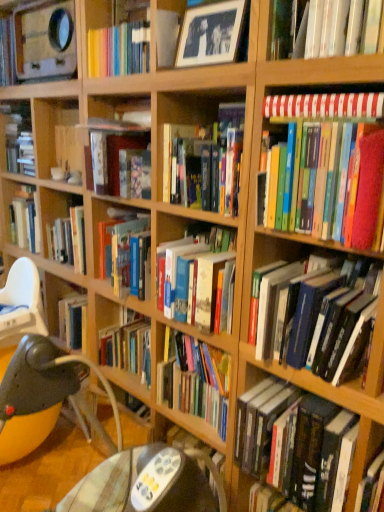
The width and height of the screenshot is (384, 512). What do you see at coordinates (324, 106) in the screenshot?
I see `red striped fabric at upper right, which ranks as the 3th book in top-to-bottom order` at bounding box center [324, 106].

Describe the element at coordinates (48, 229) in the screenshot. This screenshot has width=384, height=512. I see `hardcover books at center` at that location.

Find the location of `hardcover book at upper right, which appears as the 6th book when ordered from the bottom`. hardcover book at upper right, which appears as the 6th book when ordered from the bottom is located at coordinates (330, 28).

How much space does multicolored hardcover books at right, which is the 5th book from top to bottom, occupy vertically?

multicolored hardcover books at right, which is the 5th book from top to bottom, is 32.51 centimeters tall.

Identify the location of hardcover book at center, which appears as the first book when ordered from the bottom. (294, 443).

Is yellow fabric bean bag chair at lower left positioned with its back to hardcover book at upper left, positioned as the 1th book in top-to-bottom order?

yellow fabric bean bag chair at lower left does not have its back to hardcover book at upper left, positioned as the 1th book in top-to-bottom order.

From a real-world perspective, who is located higher, yellow fabric bean bag chair at lower left or hardcover book at upper left, marked as the seventh book in a bottom-to-top arrangement?

hardcover book at upper left, marked as the seventh book in a bottom-to-top arrangement.

The width and height of the screenshot is (384, 512). I want to click on bean bag chair below the hardcover book at upper left, marked as the seventh book in a bottom-to-top arrangement (from the image's perspective), so click(x=50, y=386).

Which is less distant, (1, 391) or (23, 118)?

The point (1, 391) is closer to the camera.

Does yellow fabric bean bag chair at lower left lie behind hardcover book at upper right, which ranks as the second book in top-to-bottom order?

Yes, yellow fabric bean bag chair at lower left is further from the viewer.

Considering the points (18, 287) and (371, 24), which point is in front, point (18, 287) or point (371, 24)?

The point (371, 24) is closer to the camera.

Is yellow fabric bean bag chair at lower left spatially inside hardcover book at upper right, which ranks as the second book in top-to-bottom order, or outside of it?

yellow fabric bean bag chair at lower left is located beyond the bounds of hardcover book at upper right, which ranks as the second book in top-to-bottom order.

From the image's perspective, is yellow fabric bean bag chair at lower left beneath hardcover book at upper right, which ranks as the second book in top-to-bottom order?

Yes, from the image's perspective, yellow fabric bean bag chair at lower left is below hardcover book at upper right, which ranks as the second book in top-to-bottom order.

Based on the photo, is hardcover book at center, arranged as the fourth book when viewed from the top, smaller than hardcover book at upper left, positioned as the 1th book in top-to-bottom order?

Incorrect, hardcover book at center, arranged as the fourth book when viewed from the top, is not smaller in size than hardcover book at upper left, positioned as the 1th book in top-to-bottom order.

Is hardcover book at center, which is the fourth book in bottom-to-top order, beside hardcover book at upper left, positioned as the 1th book in top-to-bottom order?

hardcover book at center, which is the fourth book in bottom-to-top order, and hardcover book at upper left, positioned as the 1th book in top-to-bottom order, are not in contact.

Relative to hardcover book at upper left, positioned as the 1th book in top-to-bottom order, is hardcover book at center, which is the fourth book in bottom-to-top order, in front or behind?

Visually, hardcover book at center, which is the fourth book in bottom-to-top order, is located in front of hardcover book at upper left, positioned as the 1th book in top-to-bottom order.

Is hardcover book at center, arranged as the fourth book when viewed from the top, oriented towards hardcover book at upper left, marked as the seventh book in a bottom-to-top arrangement?

No.

Could you tell me if red striped fabric at upper right, which ranks as the 3th book in top-to-bottom order, is turned towards plastic highchair at lower left?

No, red striped fabric at upper right, which ranks as the 3th book in top-to-bottom order, is not facing towards plastic highchair at lower left.

You are a GUI agent. You are given a task and a screenshot of the screen. Output one action in this format:
    pyautogui.click(x=<x>, y=<y>)
    Task: Click on the 4th book in front of the plastic highchair at lower left
    
    Given the screenshot: What is the action you would take?
    pyautogui.click(x=324, y=106)

Is red striped fabric at upper right, positioned as the fifth book in bottom-to-top order, to the right of plastic highchair at lower left from the viewer's perspective?

Yes, red striped fabric at upper right, positioned as the fifth book in bottom-to-top order, is to the right of plastic highchair at lower left.

Is red striped fabric at upper right, positioned as the fifth book in bottom-to-top order, placed right next to plastic highchair at lower left?

No, red striped fabric at upper right, positioned as the fifth book in bottom-to-top order, is not in contact with plastic highchair at lower left.

How distant is hardcover books at center from plastic highchair at lower left?

hardcover books at center is 10.19 inches away from plastic highchair at lower left.

Which is more to the right, hardcover books at center or plastic highchair at lower left?

From the viewer's perspective, hardcover books at center appears more on the right side.

Considering the relative sizes of hardcover books at center and plastic highchair at lower left in the image provided, is hardcover books at center thinner than plastic highchair at lower left?

Incorrect, the width of hardcover books at center is not less than that of plastic highchair at lower left.

From the image's perspective, does hardcover books at center appear lower than plastic highchair at lower left?

No, from the image's perspective, hardcover books at center is not beneath plastic highchair at lower left.

Who is more distant, hardcover book at center, arranged as the fourth book when viewed from the top, or hardcover books at right, the second book ordered from the bottom?

hardcover book at center, arranged as the fourth book when viewed from the top, is behind.

Can you confirm if hardcover book at center, arranged as the fourth book when viewed from the top, is shorter than hardcover books at right, which is counted as the sixth book, starting from the top?

Indeed, hardcover book at center, arranged as the fourth book when viewed from the top, has a lesser height compared to hardcover books at right, which is counted as the sixth book, starting from the top.

Is hardcover book at center, arranged as the fourth book when viewed from the top, wider than hardcover books at right, the second book ordered from the bottom?

Incorrect, the width of hardcover book at center, arranged as the fourth book when viewed from the top, does not surpass that of hardcover books at right, the second book ordered from the bottom.

Which book is the 2nd one when counting from the back of the hardcover books at right, the second book ordered from the bottom? Please provide its 2D coordinates.

[(197, 159)]

From the picture: From a real-world perspective, which object rests below the other?

From a 3D spatial view, hardcover book at upper left, marked as the seventh book in a bottom-to-top arrangement, is below.

Which is more to the right, hardcover book at upper left, positioned as the 1th book in top-to-bottom order, or hardcover book at upper right, which appears as the 6th book when ordered from the bottom?

hardcover book at upper right, which appears as the 6th book when ordered from the bottom, is more to the right.

From the image's perspective, is hardcover book at upper left, marked as the seventh book in a bottom-to-top arrangement, below hardcover book at upper right, which appears as the 6th book when ordered from the bottom?

Incorrect, from the image's perspective, hardcover book at upper left, marked as the seventh book in a bottom-to-top arrangement, is higher than hardcover book at upper right, which appears as the 6th book when ordered from the bottom.

Identify the location of the 6th book above the yellow fabric bean bag chair at lower left (from the image's perspective). Image resolution: width=384 pixels, height=512 pixels. (18, 138).

Identify the location of bean bag chair below the hardcover book at upper right, which appears as the 6th book when ordered from the bottom (from a real-world perspective). The image size is (384, 512). (50, 386).

From the picture: Estimate the real-world distances between objects in this image. Which object is further from multicolored hardcover books at right, which is the 5th book from top to bottom, hardcover books at right, which is counted as the sixth book, starting from the top, or hardcover book at upper left, positioned as the 1th book in top-to-bottom order?

The object further to multicolored hardcover books at right, which is the 5th book from top to bottom, is hardcover book at upper left, positioned as the 1th book in top-to-bottom order.

Which object lies nearer to the anchor point hardcover book at center, which appears as the first book when ordered from the bottom, black glossy picture frame at upper center or hardcover book at upper left, positioned as the 1th book in top-to-bottom order?

→ Among the two, black glossy picture frame at upper center is located nearer to hardcover book at center, which appears as the first book when ordered from the bottom.

Which object lies further to the anchor point hardcover book at upper right, which appears as the 6th book when ordered from the bottom, multicolored hardcover books at right, acting as the third book starting from the bottom, or hardcover book at center, arranged as the fourth book when viewed from the top?

hardcover book at center, arranged as the fourth book when viewed from the top.

Considering their positions, is yellow fabric bean bag chair at lower left positioned closer to red striped fabric at upper right, which ranks as the 3th book in top-to-bottom order, than hardcover books at center?

hardcover books at center is closer to red striped fabric at upper right, which ranks as the 3th book in top-to-bottom order.

Considering their positions, is hardcover books at right, which is counted as the sixth book, starting from the top, positioned closer to hardcover book at upper right, which ranks as the second book in top-to-bottom order, than hardcover book at center, which appears as the first book when ordered from the bottom?

hardcover books at right, which is counted as the sixth book, starting from the top, is positioned closer to the anchor hardcover book at upper right, which ranks as the second book in top-to-bottom order.

When comparing their distances from black glossy picture frame at upper center, does plastic highchair at lower left or red striped fabric at upper right, positioned as the fifth book in bottom-to-top order, seem closer?

The object closer to black glossy picture frame at upper center is red striped fabric at upper right, positioned as the fifth book in bottom-to-top order.

Estimate the real-world distances between objects in this image. Which object is further from black glossy picture frame at upper center, hardcover book at center, which is the fourth book in bottom-to-top order, or yellow fabric bean bag chair at lower left?

The object further to black glossy picture frame at upper center is yellow fabric bean bag chair at lower left.

Which object lies nearer to the anchor point black glossy picture frame at upper center, multicolored hardcover books at right, acting as the third book starting from the bottom, or hardcover book at upper right, which ranks as the second book in top-to-bottom order?

hardcover book at upper right, which ranks as the second book in top-to-bottom order, is positioned closer to the anchor black glossy picture frame at upper center.

I want to click on book situated between yellow fabric bean bag chair at lower left and hardcover book at center, the 7th book positioned from the top, from left to right, so click(x=197, y=159).

Identify the location of picture frame located between yellow fabric bean bag chair at lower left and red striped fabric at upper right, positioned as the fifth book in bottom-to-top order, in the left-right direction. The height and width of the screenshot is (512, 384). (210, 34).

Find the location of a particular element. The width and height of the screenshot is (384, 512). book between hardcover book at center, which is the fourth book in bottom-to-top order, and hardcover books at right, which is counted as the sixth book, starting from the top, vertically is located at coordinates (327, 167).

Where is `shelf between multicolored hardcover books at right, which is the 5th book from top to bottom, and hardcover book at upper left, positioned as the 1th book in top-to-bottom order, in the front-back direction`? Image resolution: width=384 pixels, height=512 pixels. shelf between multicolored hardcover books at right, which is the 5th book from top to bottom, and hardcover book at upper left, positioned as the 1th book in top-to-bottom order, in the front-back direction is located at coordinates (48, 229).